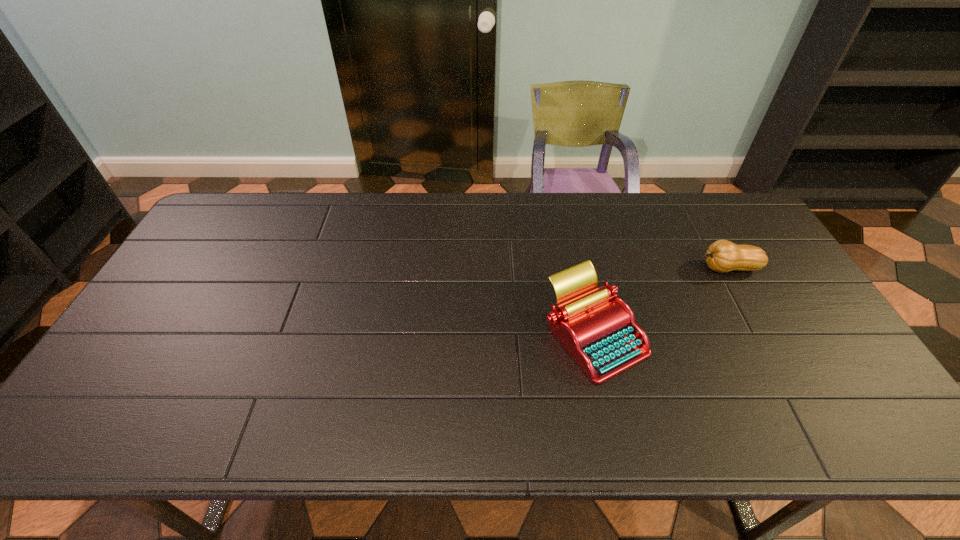
I want to click on vacant space at the near edge of the desktop, so click(640, 444).

Image resolution: width=960 pixels, height=540 pixels. In order to click on vacant area at the left edge of the desktop in this screenshot , I will do `click(209, 239)`.

The width and height of the screenshot is (960, 540). What are the coordinates of `free space at the right edge of the desktop` in the screenshot? It's located at (771, 264).

What are the coordinates of `vacant area at the far left corner of the desktop` in the screenshot? It's located at (222, 203).

In the image, there is a desktop. At what (x,y) coordinates should I click in order to perform the action: click on vacant space at the far right corner. Please return your answer as a coordinate pair (x, y). This screenshot has height=540, width=960. Looking at the image, I should click on (717, 213).

You are a GUI agent. You are given a task and a screenshot of the screen. Output one action in this format:
    pyautogui.click(x=<x>, y=<y>)
    Task: Click on the free location that satisfies the following two spatial constraints: 1. on the stem side of the gourd; 2. on the typing side of the nearer object
    The height and width of the screenshot is (540, 960).
    Given the screenshot: What is the action you would take?
    pyautogui.click(x=764, y=335)

Where is `free space that satisfies the following two spatial constraints: 1. on the stem side of the shorter object; 2. on the typing side of the typewriter`? Image resolution: width=960 pixels, height=540 pixels. free space that satisfies the following two spatial constraints: 1. on the stem side of the shorter object; 2. on the typing side of the typewriter is located at coordinates (764, 335).

You are a GUI agent. You are given a task and a screenshot of the screen. Output one action in this format:
    pyautogui.click(x=<x>, y=<y>)
    Task: Click on the free space that satisfies the following two spatial constraints: 1. on the stem side of the farther object; 2. on the typing side of the left object
    
    Given the screenshot: What is the action you would take?
    point(764,335)

At what (x,y) coordinates should I click in order to perform the action: click on free point that satisfies the following two spatial constraints: 1. on the stem side of the farther object; 2. on the typing side of the nearer object. Please return your answer as a coordinate pair (x, y). Looking at the image, I should click on (764, 335).

Find the location of a particular element. vacant point that satisfies the following two spatial constraints: 1. on the stem side of the right object; 2. on the typing side of the taller object is located at coordinates (764, 335).